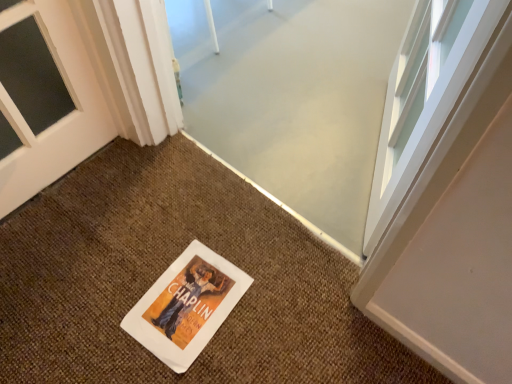
Question: Is point (202, 284) closer or farther from the camera than point (202, 380)?

Choices:
 (A) farther
 (B) closer

Answer: (A)

Question: Is white paper flyer at center in front of or behind white paper doormat at center in the image?

Choices:
 (A) behind
 (B) front

Answer: (A)

Question: From their relative heights in the image, would you say white paper flyer at center is taller or shorter than white paper doormat at center?

Choices:
 (A) tall
 (B) short

Answer: (B)

Question: Is point (108, 206) positioned closer to the camera than point (167, 274)?

Choices:
 (A) farther
 (B) closer

Answer: (A)

Question: Considering their positions, is white paper doormat at center located in front of or behind white paper flyer at center?

Choices:
 (A) front
 (B) behind

Answer: (A)

Question: Visually, is white paper doormat at center positioned to the left or to the right of white paper flyer at center?

Choices:
 (A) right
 (B) left

Answer: (A)

Question: Considering the positions of white paper doormat at center and white paper flyer at center in the image, is white paper doormat at center wider or thinner than white paper flyer at center?

Choices:
 (A) wide
 (B) thin

Answer: (A)